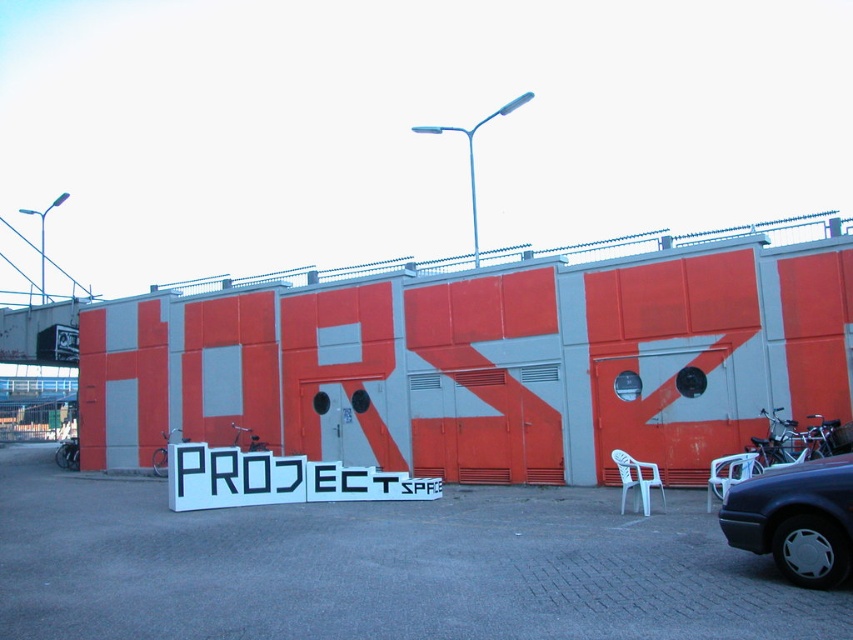
You are standing in front of the industrial building and need to park your car, which is 4 meters long. The gray concrete parking lot at center and the dark gray metallic car at lower right are in your way. Can you fit your car between them without moving the existing car?

The gray concrete parking lot at center is 3.08 meters away from the dark gray metallic car at lower right. Since your car is 4 meters long, which is longer than the distance between them, you cannot fit your car between them without moving the existing car.